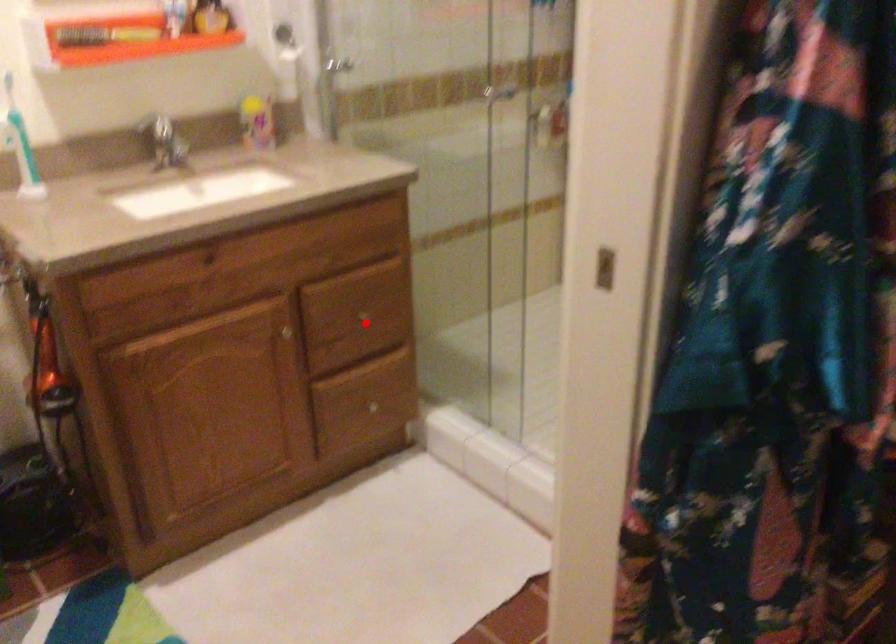
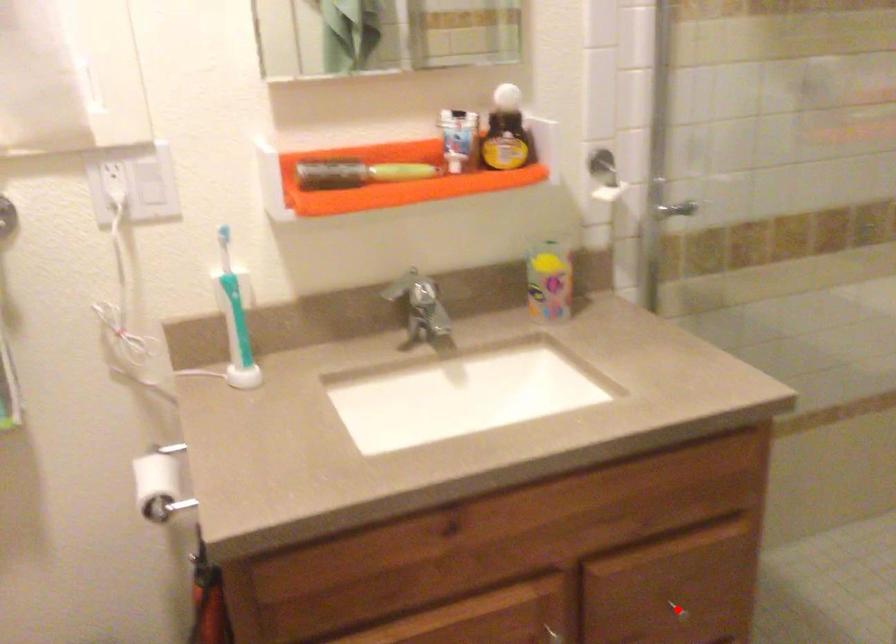
I am providing you with two images of the same scene from different viewpoints. A red point is marked on the first image and another point is marked on the second image. Does the point marked in image1 correspond to the same location as the one in image2?

Yes